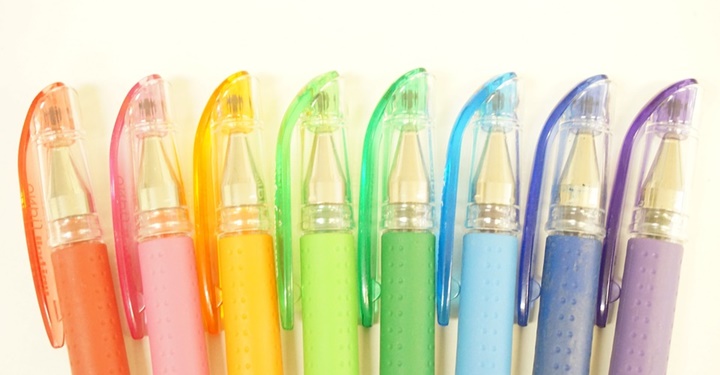
The image size is (720, 375). In order to click on pen caps in this screenshot , I will do `click(66, 209)`, `click(156, 197)`, `click(232, 191)`, `click(332, 191)`, `click(410, 189)`, `click(505, 193)`, `click(572, 196)`, `click(652, 205)`.